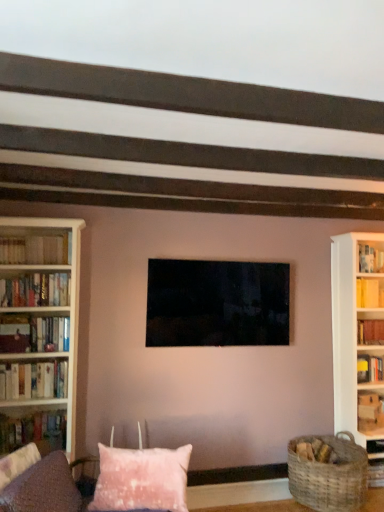
Question: Is white wooden bookcase at left bigger or smaller than hardcover books at left, which is the fifth book from top to bottom?

Choices:
 (A) small
 (B) big

Answer: (B)

Question: Is white wooden bookcase at left in front of or behind hardcover books at left, placed as the 4th book when sorted from right to left, in the image?

Choices:
 (A) front
 (B) behind

Answer: (A)

Question: Which is nearer to the pink fluffy pillow at lower center?

Choices:
 (A) pink fabric couch at lower center
 (B) hardcover books at left, placed as the second book when sorted from left to right
 (C) hardcover books at left, which appears as the 1th book when viewed from the left
 (D) matte black tv at center
 (E) hardcover book at left, marked as the second book in a right-to-left arrangement

Answer: (A)

Question: Based on their relative distances, which object is farther from the hardcover book at left, which is the 4th book from bottom to top?

Choices:
 (A) wooden bookshelf at right, the fourth book positioned from the top
 (B) woven brown basket at lower right
 (C) hardcover book at left, which is the 1th book from bottom to top
 (D) hardcover books at left, the 6th book in the bottom-to-top sequence
 (E) white wooden bookcase at left

Answer: (A)